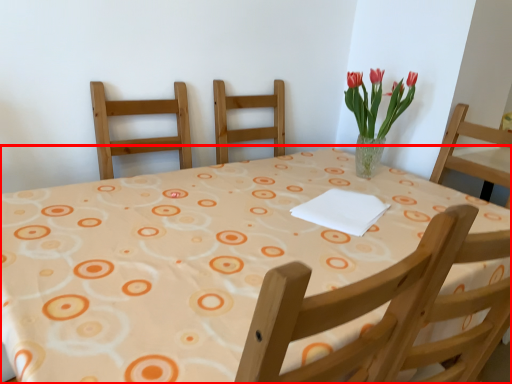
Question: From the image's perspective, what is the correct spatial positioning of table (annotated by the red box) in reference to floral arrangement?

Choices:
 (A) below
 (B) above

Answer: (A)